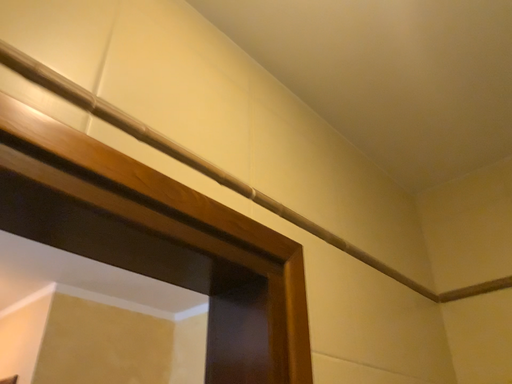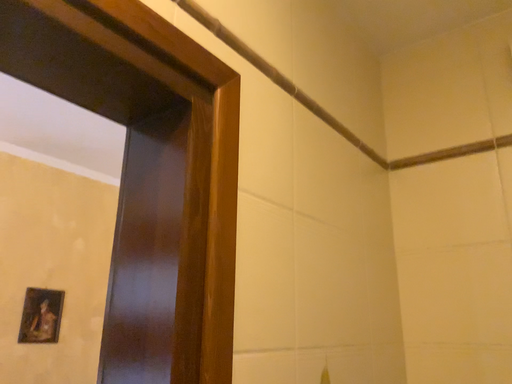
Question: Which way did the camera rotate in the video?

Choices:
 (A) rotated upward
 (B) rotated downward

Answer: (B)